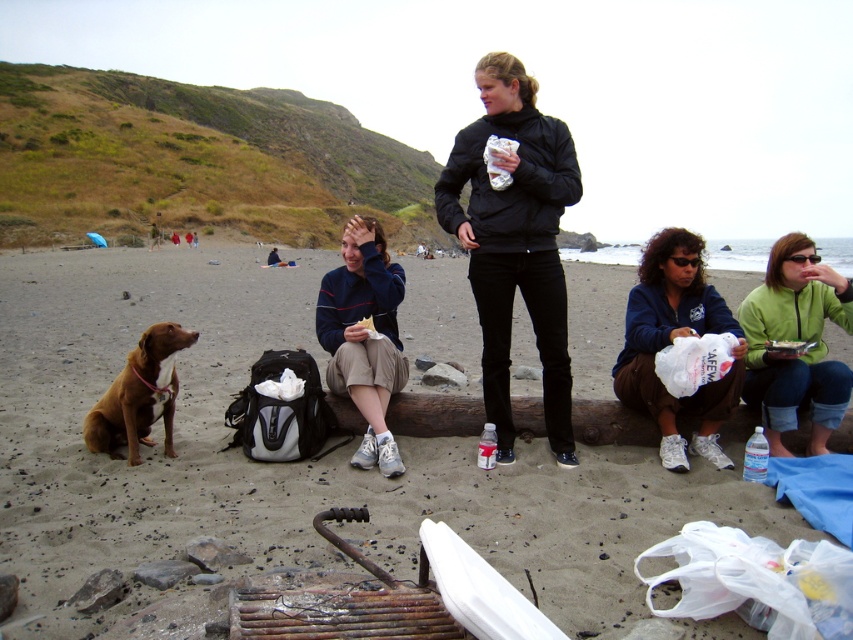
Who is shorter, brown sandy beach at center or green fleece jacket at lower right?

With less height is green fleece jacket at lower right.

Looking at this image, who is more forward, (206, 384) or (836, 292)?

Point (836, 292) is more forward.

Identify the location of brown sandy beach at center. (292, 461).

Is black matte jacket at center to the left of brown fur dog at lower left from the viewer's perspective?

In fact, black matte jacket at center is to the right of brown fur dog at lower left.

Which of these two, black matte jacket at center or brown fur dog at lower left, stands taller?

Standing taller between the two is brown fur dog at lower left.

Who is more distant from viewer, (x=544, y=150) or (x=170, y=440)?

Point (x=170, y=440)

Where is `black matte jacket at center`? This screenshot has height=640, width=853. black matte jacket at center is located at coordinates (515, 241).

Between blue fleece jacket at center and brown fur dog at lower left, which one has less height?

Standing shorter between the two is brown fur dog at lower left.

The image size is (853, 640). Find the location of `blue fleece jacket at center`. blue fleece jacket at center is located at coordinates (364, 337).